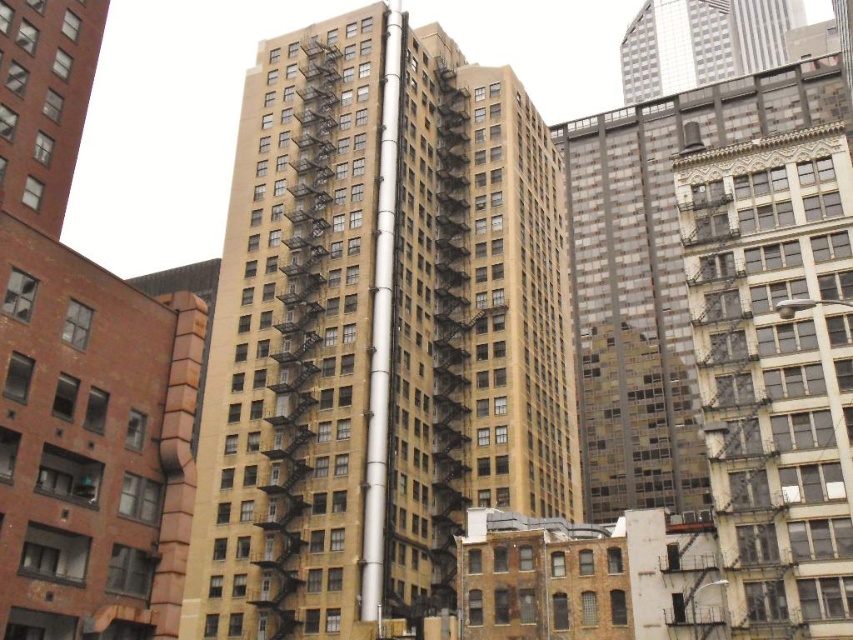
Based on the photo, you are an urban planner assessing the cityscape. You notice the silver metallic skyscraper at upper right and the silver metallic pole at center. Which of these two objects occupies a greater area in the scene?

The silver metallic skyscraper at upper right has a larger size compared to the silver metallic pole at center, so it occupies a greater area in the scene.

You are a drone operator tasked with flying a drone between the beige concrete building at center and the silver metallic skyscraper at upper right. The drone has a maximum flight distance of 150 meters. Can the drone safely make the trip between these two buildings without exceeding its range?

The beige concrete building at center and silver metallic skyscraper at upper right are 166.36 meters apart, which exceeds the drone operator maximum flight distance of 150 meters. The drone cannot safely make the trip between these two buildings without exceeding its range.

You are standing at the camera position and want to take a photo of the silver metallic skyscraper at upper right. Given that your camera has a maximum zoom range of 200 meters, will you be able to capture the entire skyscraper in the photo without moving closer?

The silver metallic skyscraper at upper right and camera are 220.05 meters apart from each other, which exceeds the camera maximum zoom range of 200 meters. Therefore, you won not be able to capture the entire skyscraper in the photo without moving closer.